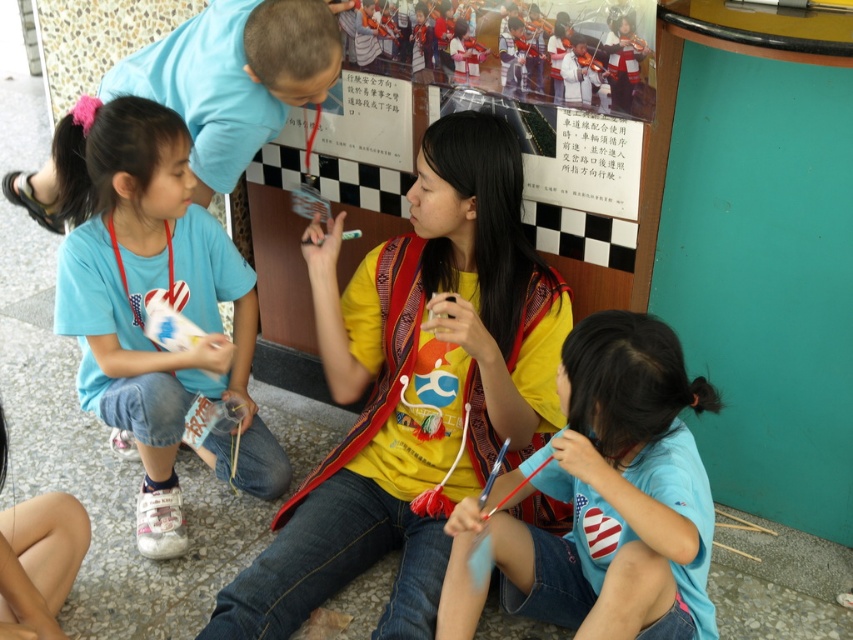
You are standing in front of the group of children and notice two points marked in the scene. The first point is at coordinate point [497,180] and the second is at point [245,262]. Which point is nearer to you?

Point [497,180] is closer to the viewer than point [245,262], so the first point is nearer to you.

You are a photographer standing in front of the scene. You want to take a photo that includes both the point at (492, 548) and the point at (187, 106). Which point should you focus on to ensure both are in sharp focus?

Result: You should focus on the point that is between both points, closer to the farther one, which would be point at (187, 106). Since point at (492, 548) is closer to the viewer than point at (187, 106), focusing on the farther point would help ensure both are in focus.

You are standing in the room where the children are working. You need to hand out a small tool to the child wearing the yellow matte shirt at center without moving closer than 1.5 meters. Is this possible?

The yellow matte shirt at center is 1.65 meters away from the viewer. Since the required minimum distance is 1.5 meters, you can hand out the tool without moving closer than 1.5 meters because 1.65 meters is beyond that distance.